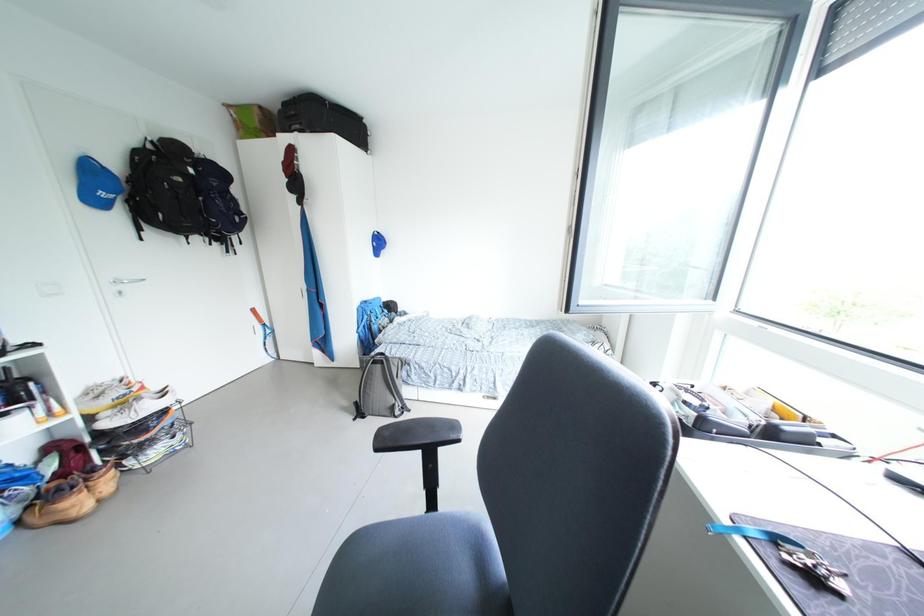
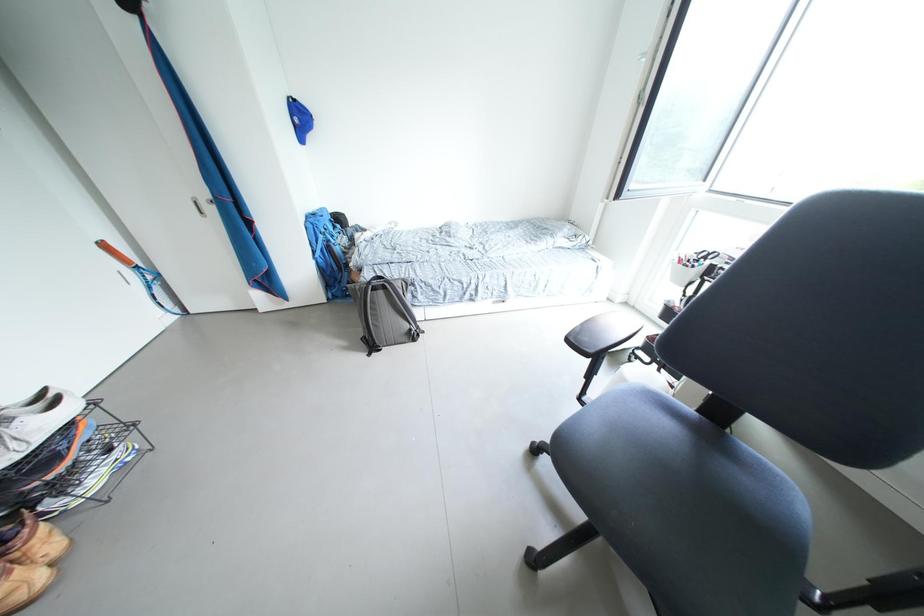
The images are taken continuously from a first-person perspective. In which direction are you moving?

The movement direction of the cameraman is left, forward.